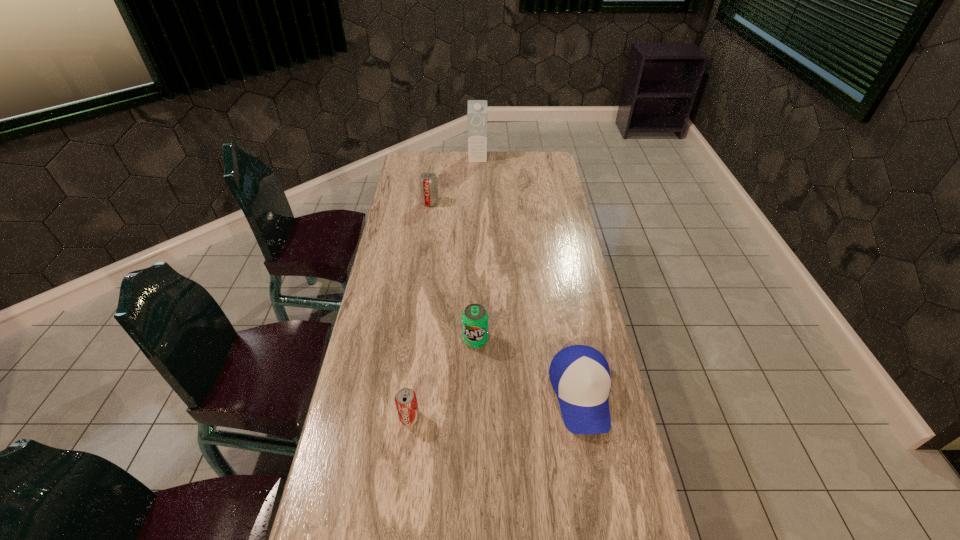
The width and height of the screenshot is (960, 540). In order to click on vacant space that is in between the farthest soda can and the rightmost soda can in this screenshot , I will do `click(453, 272)`.

This screenshot has width=960, height=540. Identify the location of vacant area between the rightmost object and the farthest object. (529, 276).

Locate an element on the screen. The width and height of the screenshot is (960, 540). free space between the rightmost object and the farthest soda can is located at coordinates (506, 299).

Find the location of a particular element. The image size is (960, 540). empty space between the tallest object and the shortest soda can is located at coordinates (444, 287).

Where is `empty space between the nearest soda can and the tallest object`? This screenshot has width=960, height=540. empty space between the nearest soda can and the tallest object is located at coordinates (444, 287).

You are a GUI agent. You are given a task and a screenshot of the screen. Output one action in this format:
    pyautogui.click(x=<x>, y=<y>)
    Task: Click on the blank region between the baseball cap and the rightmost soda can
    
    Given the screenshot: What is the action you would take?
    pyautogui.click(x=528, y=368)

Image resolution: width=960 pixels, height=540 pixels. I want to click on free space between the farthest soda can and the second farthest soda can, so click(453, 272).

You are a GUI agent. You are given a task and a screenshot of the screen. Output one action in this format:
    pyautogui.click(x=<x>, y=<y>)
    Task: Click on the empty space between the shortest soda can and the farthest soda can
    
    Given the screenshot: What is the action you would take?
    pyautogui.click(x=420, y=310)

Point out which object is positioned as the third nearest to the farthest soda can. Please provide its 2D coordinates. Your answer should be formatted as a tuple, i.e. [(x, y)], where the tuple contains the x and y coordinates of a point satisfying the conditions above.

[(579, 374)]

Locate which object is the second closest to the farthest object. Please provide its 2D coordinates. Your answer should be formatted as a tuple, i.e. [(x, y)], where the tuple contains the x and y coordinates of a point satisfying the conditions above.

[(474, 318)]